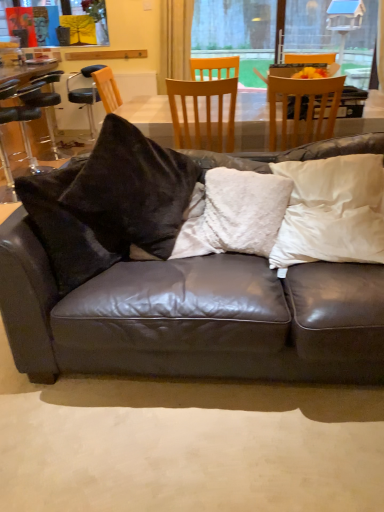
Question: Considering the relative positions of black leather bar stool at left and light brown wooden chair at center, marked as the second chair in a right-to-left arrangement, in the image provided, is black leather bar stool at left in front of light brown wooden chair at center, marked as the second chair in a right-to-left arrangement,?

Choices:
 (A) yes
 (B) no

Answer: (B)

Question: Is black leather bar stool at left touching light brown wooden chair at center, which is the second chair in left-to-right order?

Choices:
 (A) yes
 (B) no

Answer: (B)

Question: Is black leather bar stool at left smaller than light brown wooden chair at center, which is counted as the second chair, starting from the back?

Choices:
 (A) yes
 (B) no

Answer: (B)

Question: Is black leather bar stool at left not close to light brown wooden chair at center, which is counted as the second chair, starting from the back?

Choices:
 (A) yes
 (B) no

Answer: (A)

Question: Is black leather bar stool at left further to the viewer compared to light brown wooden chair at center, the 2th chair in the front-to-back sequence?

Choices:
 (A) yes
 (B) no

Answer: (A)

Question: From the image's perspective, is black leather bar stool at left under light brown wooden chair at center, which is the second chair in left-to-right order?

Choices:
 (A) no
 (B) yes

Answer: (A)

Question: From a real-world perspective, is light brown wooden chair at center, which is counted as the second chair, starting from the back, positioned under matte black leather couch at center based on gravity?

Choices:
 (A) no
 (B) yes

Answer: (A)

Question: From the image's perspective, would you say light brown wooden chair at center, marked as the second chair in a right-to-left arrangement, is positioned over matte black leather couch at center?

Choices:
 (A) yes
 (B) no

Answer: (A)

Question: Can you confirm if light brown wooden chair at center, which is counted as the second chair, starting from the back, is positioned to the left of matte black leather couch at center?

Choices:
 (A) no
 (B) yes

Answer: (B)

Question: Is light brown wooden chair at center, which is counted as the second chair, starting from the back, positioned before matte black leather couch at center?

Choices:
 (A) yes
 (B) no

Answer: (B)

Question: Is light brown wooden chair at center, the 2th chair in the front-to-back sequence, wider than matte black leather couch at center?

Choices:
 (A) no
 (B) yes

Answer: (A)

Question: Is fluffy white pillow at center, the 2th pillow when ordered from right to left, directly adjacent to white soft pillow at right, the second pillow viewed from the left?

Choices:
 (A) yes
 (B) no

Answer: (B)